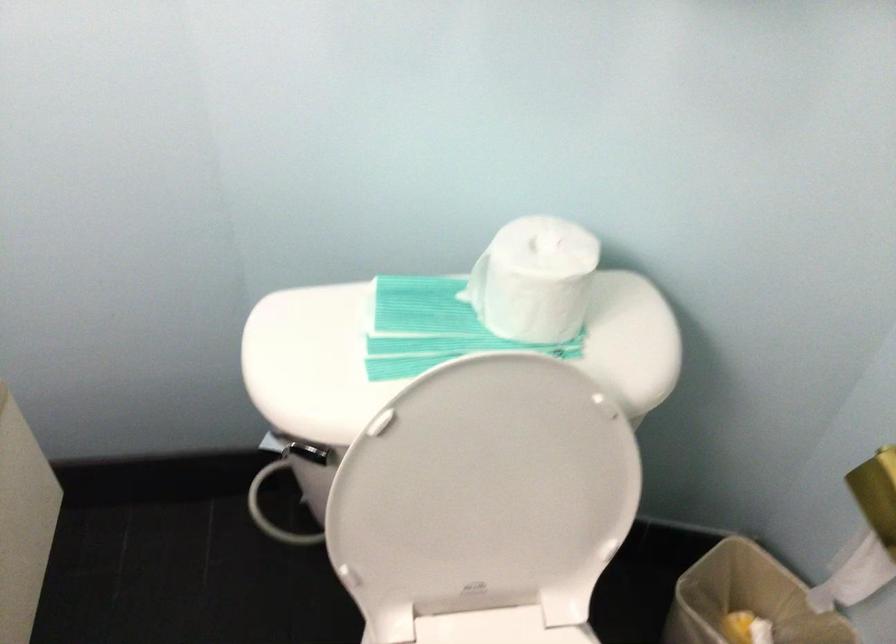
Question: The first image is from the beginning of the video and the second image is from the end. How did the camera likely rotate when shooting the video?

Choices:
 (A) Left
 (B) Right
 (C) Up
 (D) Down

Answer: (A)